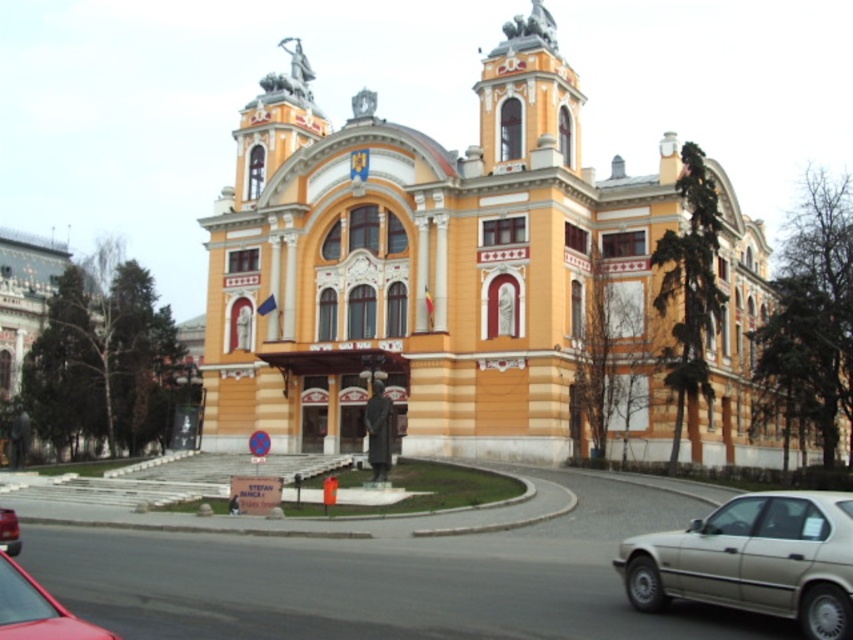
Measure the distance between point (0, 570) and camera.

A distance of 73.54 feet exists between point (0, 570) and camera.

Does shiny red car at lower left have a lesser width compared to metallic red car at lower left?

Yes.

Is point (45, 598) farther from viewer compared to point (7, 547)?

No, it is not.

The height and width of the screenshot is (640, 853). I want to click on shiny red car at lower left, so click(x=38, y=609).

Is yellow stone building at center below metallic red car at lower left?

No.

Is point (628, 449) positioned after point (0, 528)?

Yes, it is.

Find the location of a particular element. The image size is (853, 640). yellow stone building at center is located at coordinates (431, 269).

Is point (637, 406) farther from viewer compared to point (22, 608)?

Yes.

Can you confirm if yellow stone building at center is thinner than shiny red car at lower left?

No, yellow stone building at center is not thinner than shiny red car at lower left.

The height and width of the screenshot is (640, 853). Describe the element at coordinates (431, 269) in the screenshot. I see `yellow stone building at center` at that location.

Where is `yellow stone building at center`? yellow stone building at center is located at coordinates (431, 269).